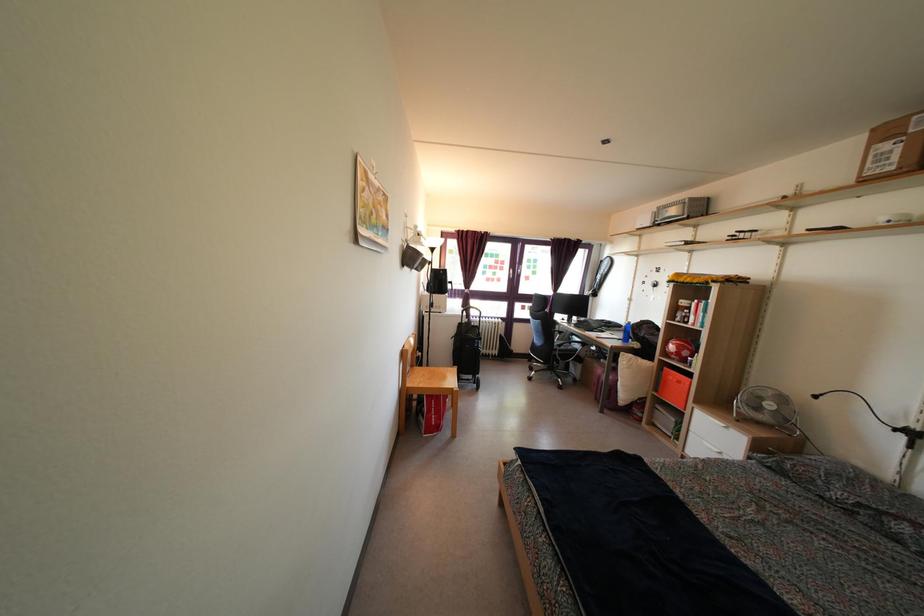
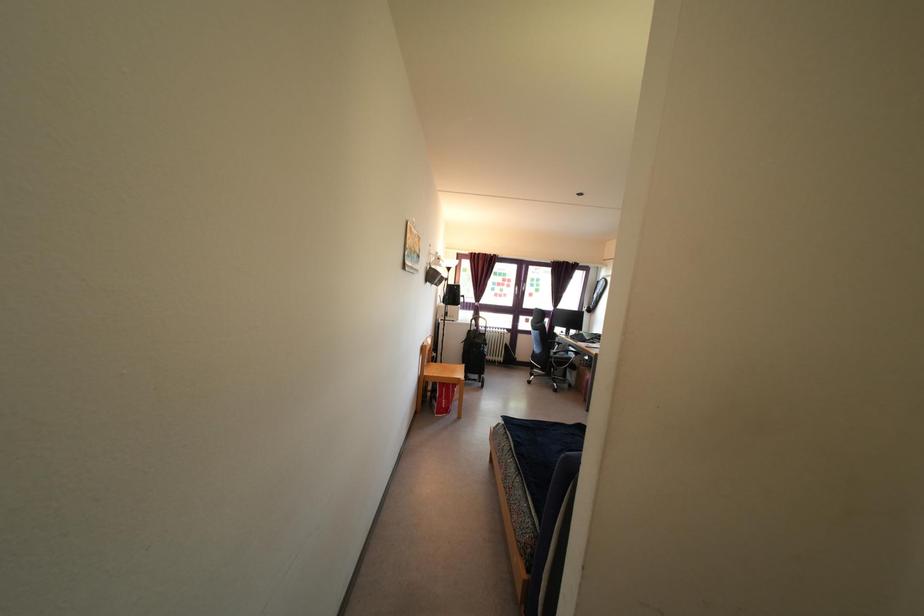
Find the pixel in the second image that matches (x=421, y=426) in the first image.

(435, 408)